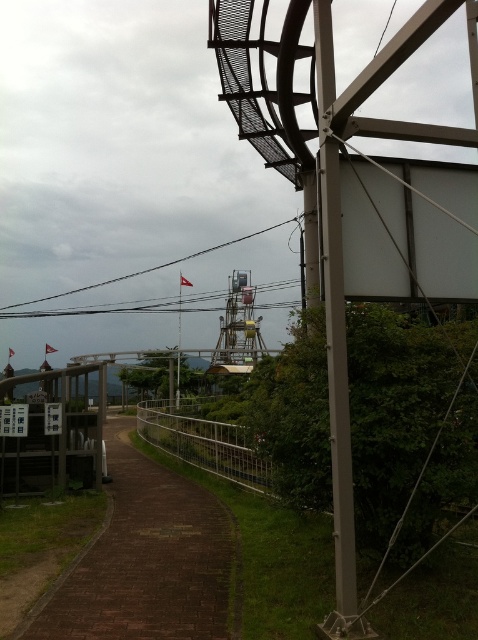
Question: Is brown brick path at center to the right of metallic pole at right from the viewer's perspective?

Choices:
 (A) no
 (B) yes

Answer: (A)

Question: Which object is closer to the camera taking this photo?

Choices:
 (A) black wire at center
 (B) metallic pole at right
 (C) brown brick path at center

Answer: (B)

Question: Is brown brick path at center above black wire at center?

Choices:
 (A) yes
 (B) no

Answer: (B)

Question: Which point is farther to the camera?

Choices:
 (A) black wire at center
 (B) brown brick path at center

Answer: (A)

Question: Which object appears closest to the camera in this image?

Choices:
 (A) black wire at center
 (B) metallic pole at right

Answer: (B)

Question: Does brown brick path at center lie in front of black wire at center?

Choices:
 (A) yes
 (B) no

Answer: (A)